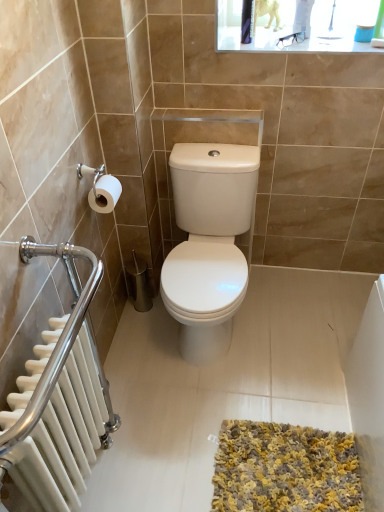
This screenshot has height=512, width=384. In order to click on vacant space to the left of yellow-grey shaggy bath mat at lower center in this screenshot , I will do `click(175, 446)`.